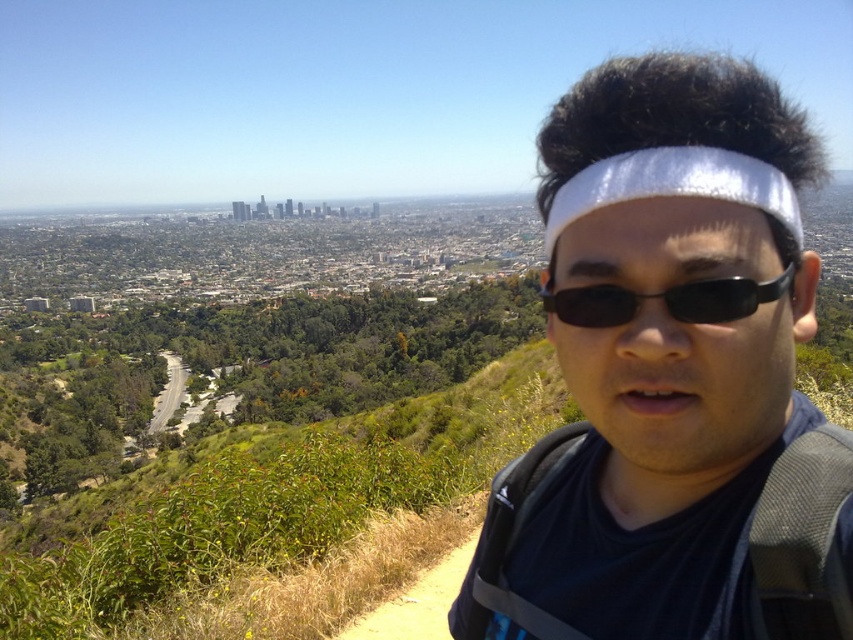
Question: Can you confirm if white reflective headband at center is positioned to the left of black plastic sunglasses at center?

Choices:
 (A) no
 (B) yes

Answer: (B)

Question: Based on their relative distances, which object is nearer to the white matte headband at center?

Choices:
 (A) white reflective headband at center
 (B) black plastic sunglasses at center

Answer: (B)

Question: Does white reflective headband at center have a greater width compared to white matte headband at center?

Choices:
 (A) no
 (B) yes

Answer: (B)

Question: Which object appears farthest from the camera in this image?

Choices:
 (A) white reflective headband at center
 (B) white matte headband at center
 (C) black plastic sunglasses at center

Answer: (C)

Question: Does black plastic sunglasses at center have a smaller size compared to white matte headband at center?

Choices:
 (A) yes
 (B) no

Answer: (A)

Question: Which of the following is the farthest from the observer?

Choices:
 (A) (718, 308)
 (B) (689, 88)

Answer: (A)